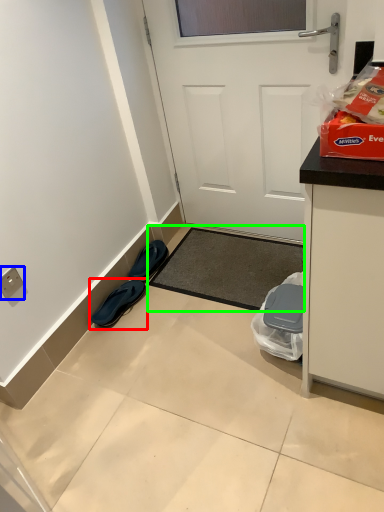
Question: Which object is the closest to the footwear (highlighted by a red box)? Choose among these: electric outlet (highlighted by a blue box) or doormat (highlighted by a green box).

Choices:
 (A) electric outlet
 (B) doormat

Answer: (B)